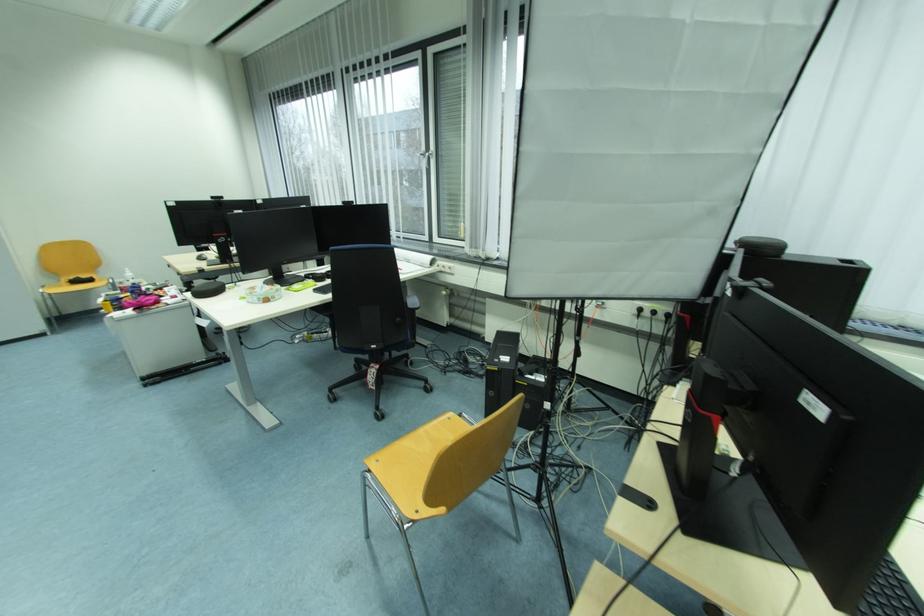
What do you see at coordinates (427, 156) in the screenshot? I see `the white window handle` at bounding box center [427, 156].